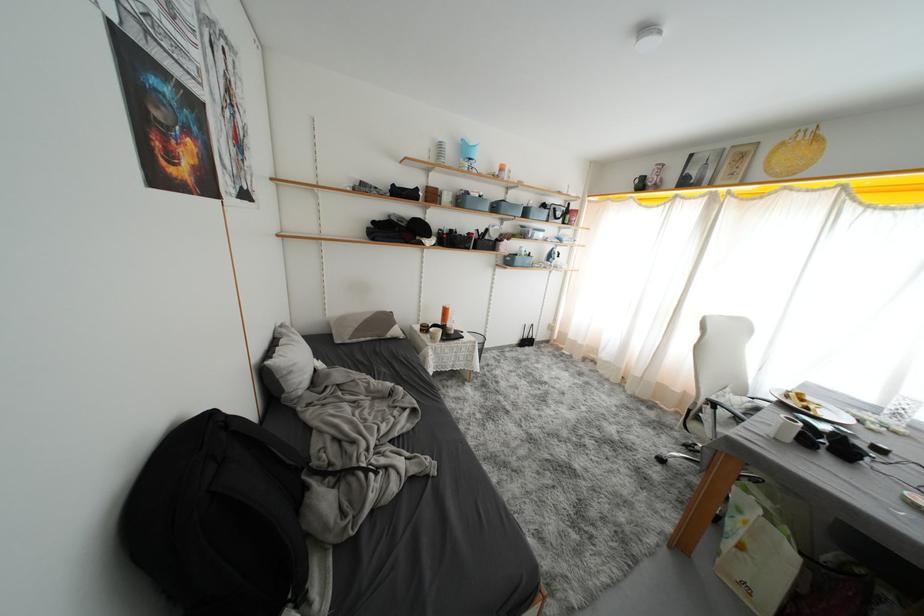
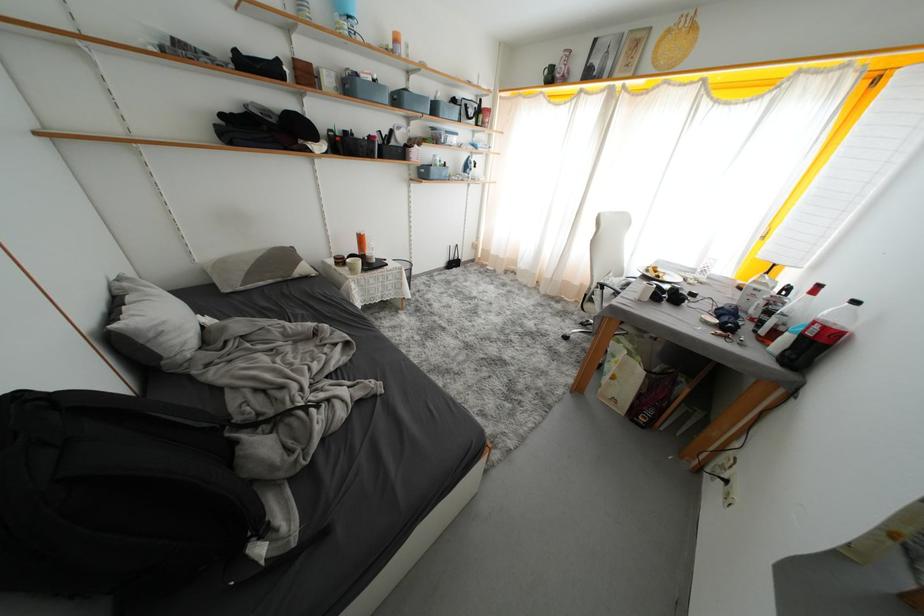
The point at (485,200) is marked in the first image. Where is the corresponding point in the second image?

(381, 84)